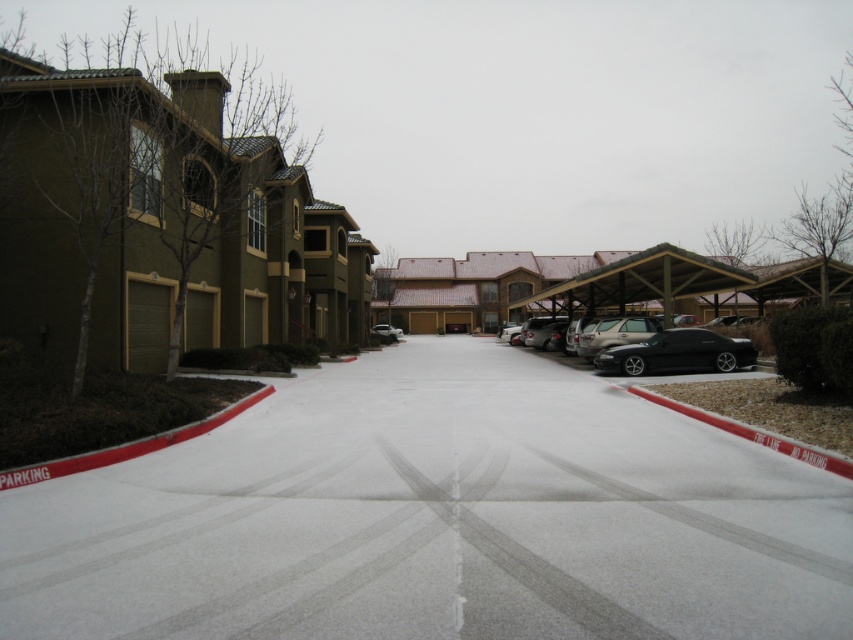
Question: Which point appears farthest from the camera in this image?

Choices:
 (A) (672, 346)
 (B) (605, 355)
 (C) (379, 365)

Answer: (C)

Question: Does shiny black sedan at center appear over black matte car at right?

Choices:
 (A) yes
 (B) no

Answer: (A)

Question: Which object is farther from the camera taking this photo?

Choices:
 (A) satin gold suv at center
 (B) shiny black sedan at center
 (C) satin silver sedan at center
 (D) black matte car at right

Answer: (C)

Question: Based on their relative distances, which object is farther from the satin gold suv at center?

Choices:
 (A) black matte car at right
 (B) shiny black sedan at center
 (C) white asphalt parking lot at center

Answer: (C)

Question: Is the position of shiny black sedan at center less distant than that of black matte car at right?

Choices:
 (A) yes
 (B) no

Answer: (B)

Question: Does white asphalt parking lot at center have a smaller size compared to shiny black sedan at center?

Choices:
 (A) yes
 (B) no

Answer: (A)